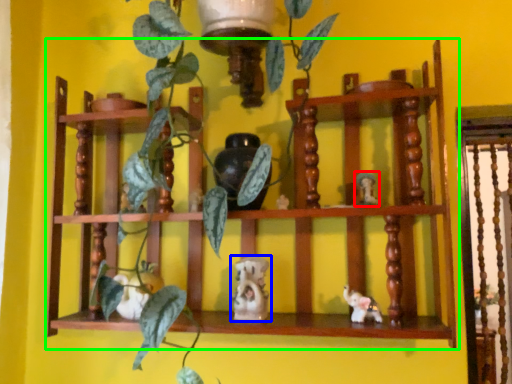
Question: Which object is positioned closest to toy (highlighted by a red box)? Select from toy (highlighted by a blue box) and shelf (highlighted by a green box).

Choices:
 (A) toy
 (B) shelf

Answer: (A)